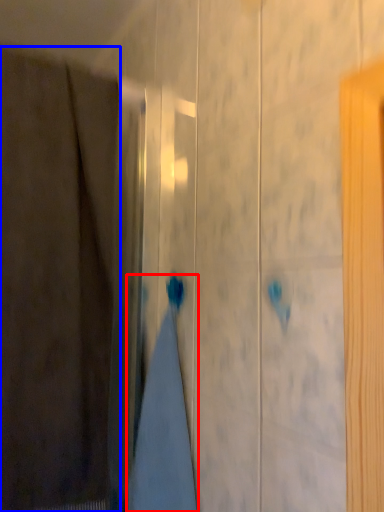
Question: Which object appears closest to the camera in this image, bath towel (highlighted by a red box) or curtain (highlighted by a blue box)?

Choices:
 (A) bath towel
 (B) curtain

Answer: (B)